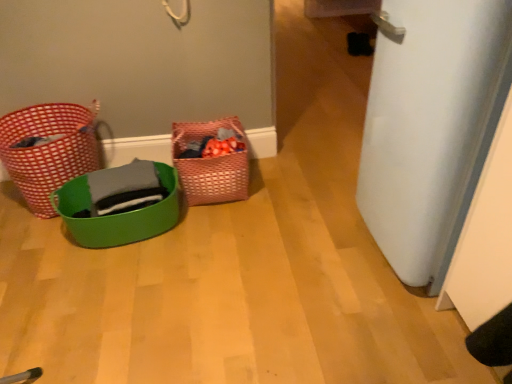
At what (x,y) coordinates should I click in order to perform the action: click on free space to the right of green plastic basket at lower left, marked as the second basket in a right-to-left arrangement. Please return your answer as a coordinate pair (x, y). This screenshot has width=512, height=384. Looking at the image, I should click on [225, 239].